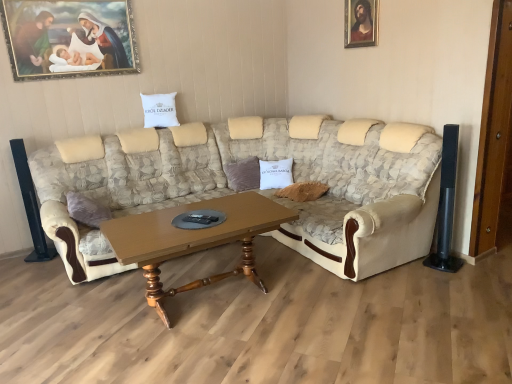
Question: Which is correct: brown wooden coffee table at center is inside white cotton pillow at center, which ranks as the 1th pillow in left-to-right order, or outside of it?

Choices:
 (A) outside
 (B) inside

Answer: (A)

Question: Considering the positions of brown wooden coffee table at center and white cotton pillow at center, the first pillow from the top, in the image, is brown wooden coffee table at center bigger or smaller than white cotton pillow at center, the first pillow from the top,?

Choices:
 (A) big
 (B) small

Answer: (A)

Question: Which of these objects is positioned closest to the brown wooden coffee table at center?

Choices:
 (A) white cotton pillow at center, which ranks as the 1th pillow in left-to-right order
 (B) beige fabric couch at center
 (C) white cotton pillow at center, which is the 2th pillow from left to right
 (D) gold-framed painting at upper left, acting as the second picture frame starting from the right
 (E) wooden framed portrait at upper right, which is counted as the second picture frame, starting from the left

Answer: (B)

Question: Based on their relative distances, which object is farther from the wooden framed portrait at upper right, which is counted as the second picture frame, starting from the left?

Choices:
 (A) beige fabric couch at center
 (B) brown wooden coffee table at center
 (C) white cotton pillow at center, the first pillow from the top
 (D) white cotton pillow at center, which appears as the first pillow when ordered from the bottom
 (E) gold-framed painting at upper left, marked as the 1th picture frame in a left-to-right arrangement

Answer: (E)